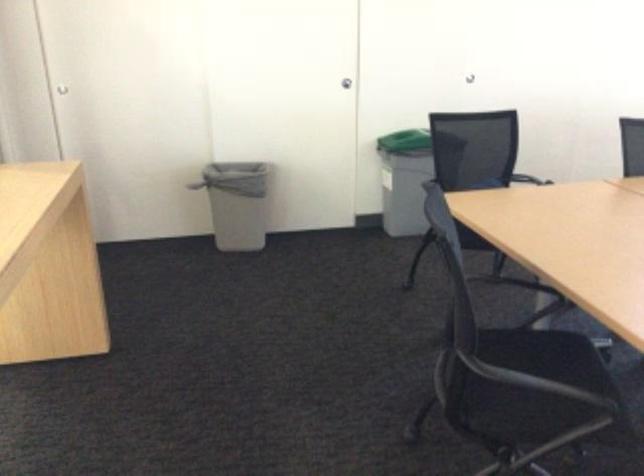
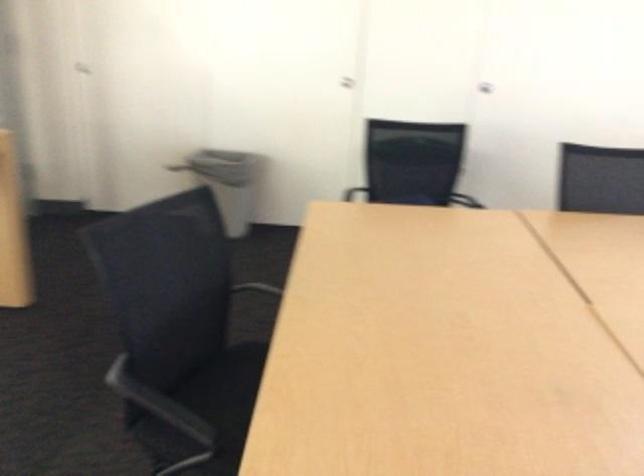
The point at (254, 156) is marked in the first image. Where is the corresponding point in the second image?

(231, 182)